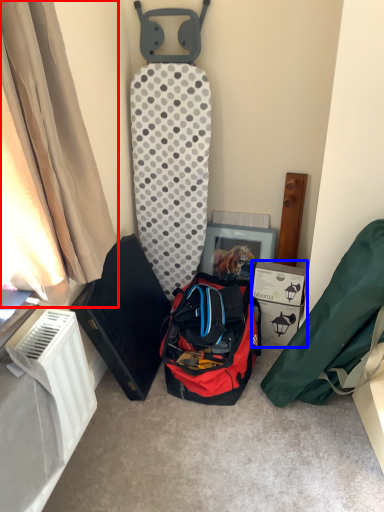
Question: Which of the following is the farthest to the observer, curtain (highlighted by a red box) or cardboard box (highlighted by a blue box)?

Choices:
 (A) curtain
 (B) cardboard box

Answer: (B)